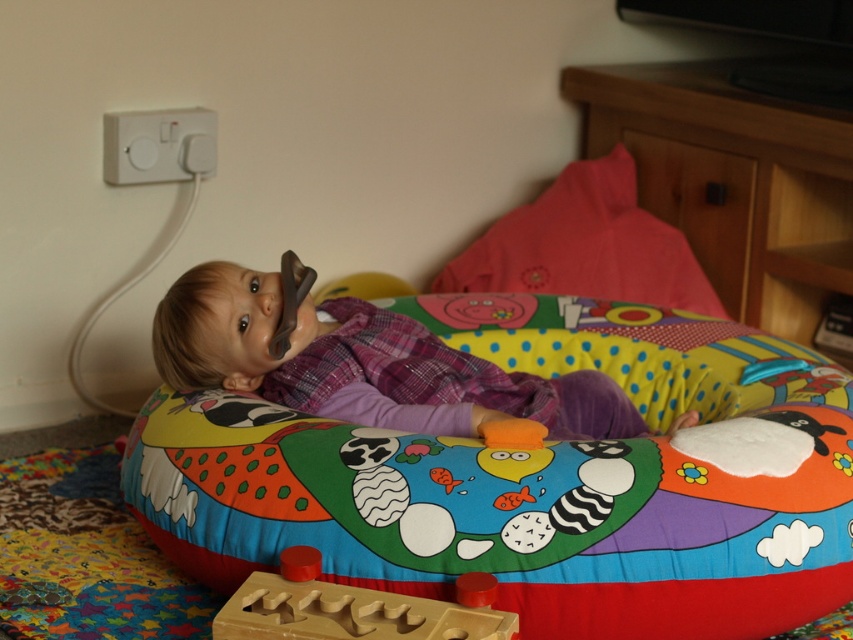
You are a photographer standing in front of the multicolored fabric bean bag at center. You want to take a photo of the bean bag and ensure it fills the frame without cropping any part of it. The camera you are using has a minimum focusing distance of 1.5 meters. Can you take the photo from your current position?

The multicolored fabric bean bag at center is 1.28 meters away from the camera, which is closer than the camera minimum focusing distance of 1.5 meters. Therefore, you cannot take the photo from your current position without the image being out of focus or cropped.

What are the coordinates of the matte plastic baby at center?

The matte plastic baby at center is located at point (361, 364).